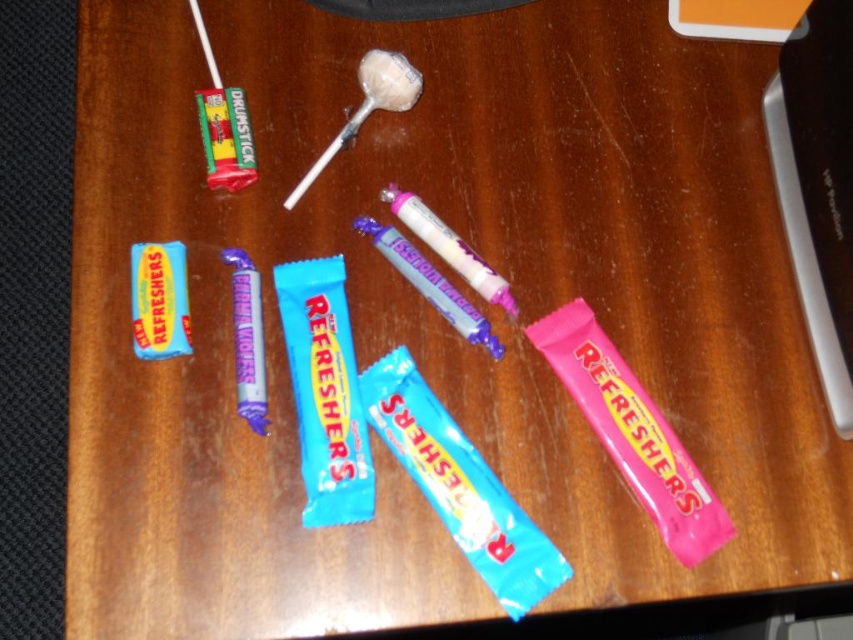
Consider the image. Is blue shiny bar at center further to camera compared to blue wrapper candy bar at center?

No, blue shiny bar at center is closer to the viewer.

What do you see at coordinates (325, 392) in the screenshot? I see `blue shiny bar at center` at bounding box center [325, 392].

Between point (276, 275) and point (486, 321), which one is positioned in front?

Point (276, 275) is more forward.

The width and height of the screenshot is (853, 640). Find the location of `blue shiny bar at center`. blue shiny bar at center is located at coordinates (325, 392).

Can you confirm if blue shiny bar at center is thinner than pink glossy lollipop at center?

Indeed, blue shiny bar at center has a lesser width compared to pink glossy lollipop at center.

Is blue shiny bar at center smaller than pink glossy lollipop at center?

Actually, blue shiny bar at center might be larger than pink glossy lollipop at center.

The image size is (853, 640). Describe the element at coordinates (325, 392) in the screenshot. I see `blue shiny bar at center` at that location.

You are a GUI agent. You are given a task and a screenshot of the screen. Output one action in this format:
    pyautogui.click(x=<x>, y=<y>)
    Task: Click on the blue shiny bar at center
    This screenshot has width=853, height=640.
    Given the screenshot: What is the action you would take?
    pyautogui.click(x=325, y=392)

Measure the distance between pink matte refreshers bar at center and camera.

They are 79.43 centimeters apart.

Who is positioned more to the left, pink matte refreshers bar at center or blue shiny bar at center?

From the viewer's perspective, blue shiny bar at center appears more on the left side.

Between point (670, 442) and point (306, 419), which one is positioned behind?

The point (670, 442) is behind.

This screenshot has height=640, width=853. What are the coordinates of `pink matte refreshers bar at center` in the screenshot? It's located at (631, 433).